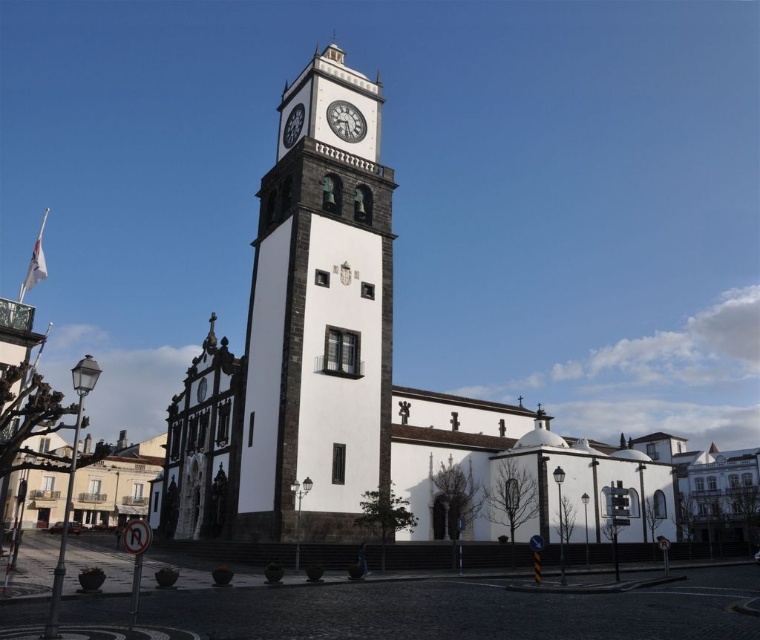
You are a maintenance worker who needs to climb a ladder to reach both the white stone clock tower at center and the white matte clock at upper center. The ladder you have can extend up to 50 feet. Can you safely reach both objects with the ladder you have?

The white stone clock tower at center and white matte clock at upper center are 47.60 feet apart from each other. Since the ladder can extend up to 50 feet, it is long enough to safely reach both objects as the distance between them is within the ladder length capacity.

In the scene shown: You are an architect assessing the proportions of the church and its clock tower. Given that the white stucco church at center and the white stone clock tower at center are both central elements, which one has a greater width?

The white stucco church at center has a greater width than the white stone clock tower at center according to the description.

Based on the scene description, what is located at the coordinates point (x=363, y=385)?

The white stucco church at center is located at point (x=363, y=385).